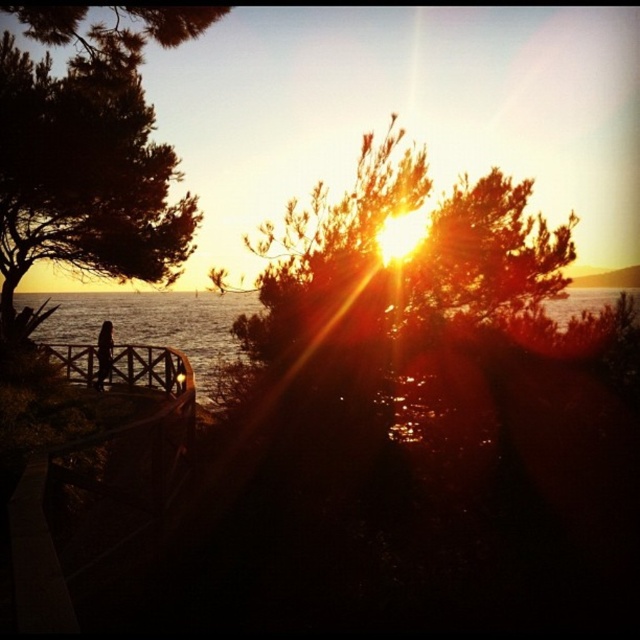
Is point (124, 61) positioned in front of point (211, 372)?

That is True.

From the picture: Does green leafy tree at left come in front of clear blue water at lower left?

Yes, it is.

Between point (112, 68) and point (54, 342), which one is positioned behind?

The point (54, 342) is more distant.

Locate an element on the screen. This screenshot has width=640, height=640. green leafy tree at left is located at coordinates (88, 150).

Is translucent water at center above silhouette wooden person at lower left?

Yes, translucent water at center is above silhouette wooden person at lower left.

Is translucent water at center behind silhouette wooden person at lower left?

No, translucent water at center is closer to the viewer.

Between point (104, 296) and point (99, 380), which one is positioned behind?

Positioned behind is point (104, 296).

You are a GUI agent. You are given a task and a screenshot of the screen. Output one action in this format:
    pyautogui.click(x=<x>, y=<y>)
    Task: Click on the translucent water at center
    
    Given the screenshot: What is the action you would take?
    pyautogui.click(x=150, y=323)

Does green leafy tree at left have a smaller size compared to wooden at left?

Actually, green leafy tree at left might be larger than wooden at left.

Which is below, green leafy tree at left or wooden at left?

wooden at left is lower down.

Identify the location of green leafy tree at left. The height and width of the screenshot is (640, 640). (88, 150).